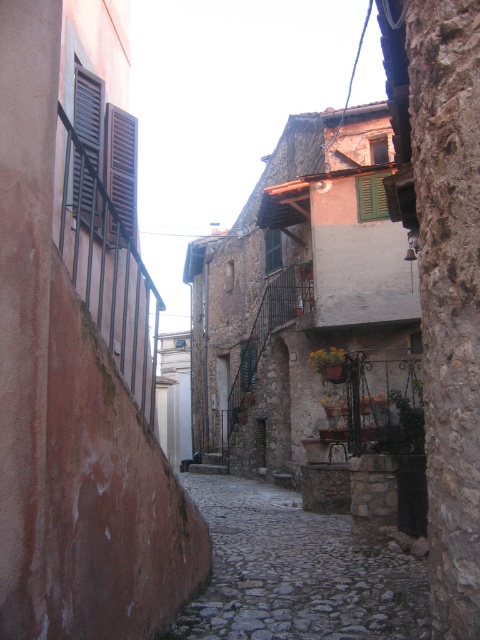
Does matte black shutters at upper left have a smaller size compared to green matte shutter at upper center?

Correct, matte black shutters at upper left occupies less space than green matte shutter at upper center.

What do you see at coordinates (87, 145) in the screenshot? The width and height of the screenshot is (480, 640). I see `matte black shutters at upper left` at bounding box center [87, 145].

Does point (86, 131) lie behind point (384, 211)?

No.

Image resolution: width=480 pixels, height=640 pixels. In order to click on matte black shutters at upper left in this screenshot , I will do pyautogui.click(x=87, y=145).

Does matte black shutters at upper left have a lesser width compared to matte black shutters at left?

Correct, matte black shutters at upper left's width is less than matte black shutters at left's.

Which is in front, point (82, 186) or point (108, 129)?

Positioned in front is point (82, 186).

The width and height of the screenshot is (480, 640). In order to click on matte black shutters at upper left in this screenshot , I will do `click(87, 145)`.

Is cobblestone path at center below green matte shutter at upper center?

Correct, cobblestone path at center is located below green matte shutter at upper center.

Can you confirm if cobblestone path at center is shorter than green matte shutter at upper center?

Incorrect, cobblestone path at center's height does not fall short of green matte shutter at upper center's.

Which is in front, point (381, 637) or point (365, 182)?

Point (381, 637) is in front.

Locate an element on the screen. cobblestone path at center is located at coordinates (296, 572).